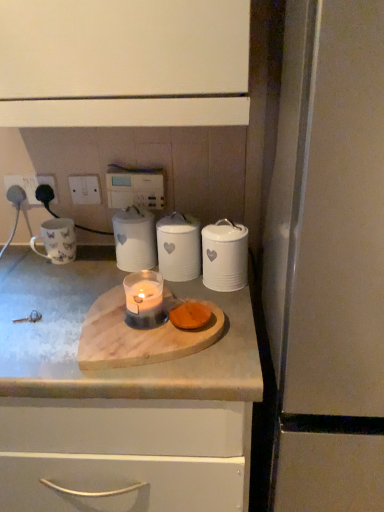
You are a GUI agent. You are given a task and a screenshot of the screen. Output one action in this format:
    pyautogui.click(x=<x>, y=<y>)
    Task: Click on the vacant area on the back side of wooden cutting board at center
    
    Given the screenshot: What is the action you would take?
    pyautogui.click(x=108, y=276)